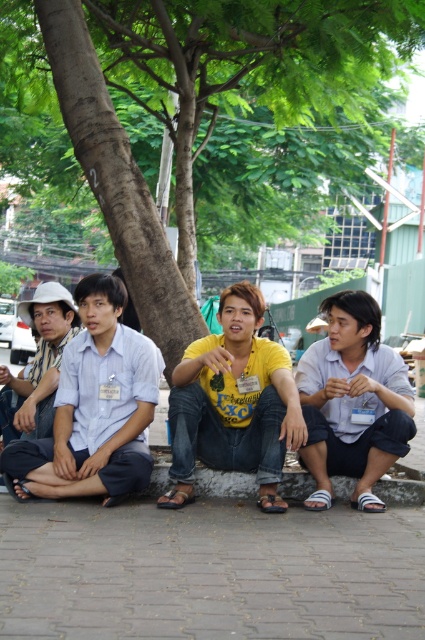
Measure the distance between brown rough tree trunk at center and camera.

brown rough tree trunk at center is 5.67 meters away from camera.

Does point (124, 198) come behind point (334, 433)?

Yes, it is.

Describe the element at coordinates (184, 100) in the screenshot. I see `brown rough tree trunk at center` at that location.

The width and height of the screenshot is (425, 640). Find the location of `brown rough tree trunk at center`. brown rough tree trunk at center is located at coordinates (184, 100).

Which is more to the right, light blue shirt at left or white matte shirt at center?

white matte shirt at center

Based on the photo, is light blue shirt at left above white matte shirt at center?

Yes.

The image size is (425, 640). Identify the location of light blue shirt at left. (93, 408).

Is yellow matte shirt at center to the right of white matte shirt at center from the viewer's perspective?

No, yellow matte shirt at center is not to the right of white matte shirt at center.

Which is more to the left, yellow matte shirt at center or white matte shirt at center?

yellow matte shirt at center

This screenshot has width=425, height=640. Describe the element at coordinates (234, 403) in the screenshot. I see `yellow matte shirt at center` at that location.

This screenshot has width=425, height=640. Find the location of `yellow matte shirt at center`. yellow matte shirt at center is located at coordinates (234, 403).